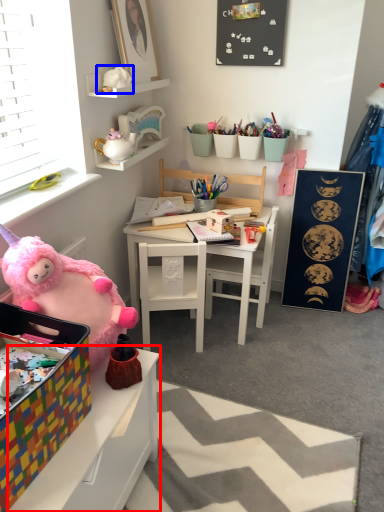
Question: Which object appears closest to the camera in this image, table (highlighted by a red box) or toy (highlighted by a blue box)?

Choices:
 (A) table
 (B) toy

Answer: (A)